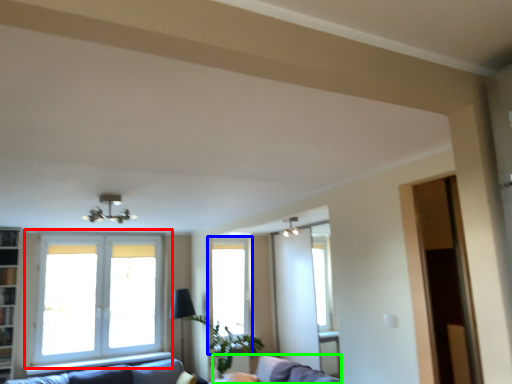
Question: Based on their relative distances, which object is farther from window (highlighted by a red box)? Choose from window (highlighted by a blue box) and swivel chair (highlighted by a green box).

Choices:
 (A) window
 (B) swivel chair

Answer: (B)